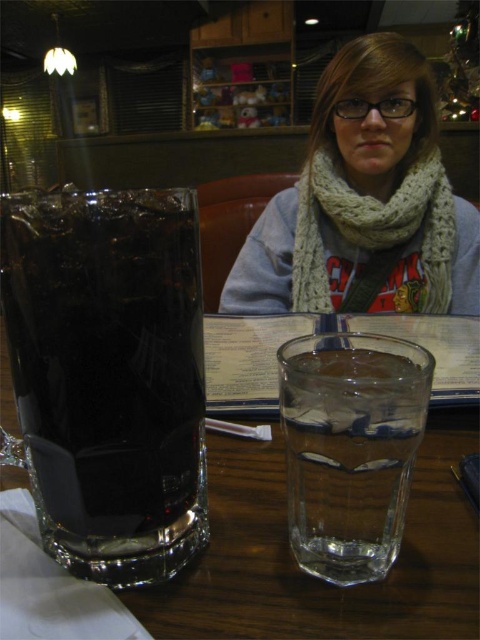
You are a customer at this cozy restaurant and want to reach for the clear glass water at center without moving the dark glass mug at left. Can you do this easily?

The dark glass mug at left is to the left of clear glass water at center, so there should be space to the right of the dark glass mug at left to reach the clear glass water at center without moving it.

You are a customer at this restaurant and want to place your phone on the table. You have a phone that is 15 cm wide. Can you fit it on the clear glass water at center without it touching the dark glass mug at left?

The dark glass mug at left is wider than the clear glass water at center. Since the phone is 15 cm wide, it depends on the available space between them. However, the description only states the mug is wider, not the distance between them. Therefore, we cannot confirm if the phone will fit without more information about the spacing between the two glasses.

You are a barista trying to place a new drink order on the table. There is a dark glass mug at left and a white knitted scarf at upper center on the table. Which object should you move to make space, and why?

You should move the white knitted scarf at upper center because it occupies more space than the dark glass mug at left, according to the description.